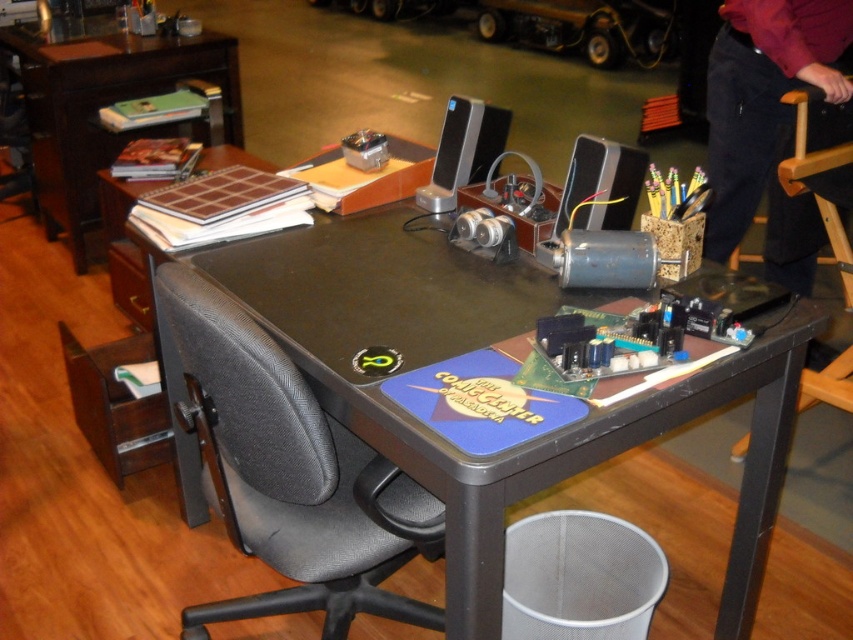
Between dark blue jeans at lower right and wooden chair at right, which one has less height?

dark blue jeans at lower right is shorter.

Is dark blue jeans at lower right taller than wooden chair at right?

Incorrect, dark blue jeans at lower right's height is not larger of wooden chair at right's.

Where is `dark blue jeans at lower right`? This screenshot has height=640, width=853. dark blue jeans at lower right is located at coordinates (769, 124).

Which is more to the right, black plastic table at center or metallic gray speaker at center?

metallic gray speaker at center

Who is positioned more to the left, black plastic table at center or metallic gray speaker at center?

Positioned to the left is black plastic table at center.

This screenshot has width=853, height=640. What are the coordinates of `black plastic table at center` in the screenshot? It's located at (479, 346).

Can you confirm if brown wood table at upper left is positioned to the left of metallic gray speaker at center?

Indeed, brown wood table at upper left is positioned on the left side of metallic gray speaker at center.

What do you see at coordinates (103, 106) in the screenshot?
I see `brown wood table at upper left` at bounding box center [103, 106].

Describe the element at coordinates (103, 106) in the screenshot. I see `brown wood table at upper left` at that location.

The height and width of the screenshot is (640, 853). Identify the location of brown wood table at upper left. (103, 106).